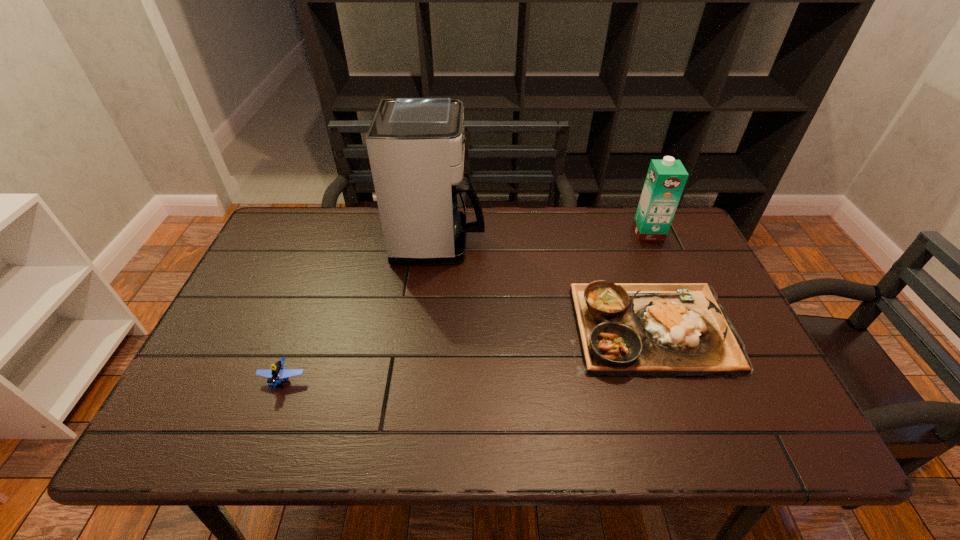
Locate an element on the screen. This screenshot has width=960, height=540. object that is the second closest to the third shortest object is located at coordinates (416, 146).

Find the location of a particular element. vacant space that satisfies the following two spatial constraints: 1. on the front side of the carton; 2. on the front panel of the coffee maker is located at coordinates (653, 241).